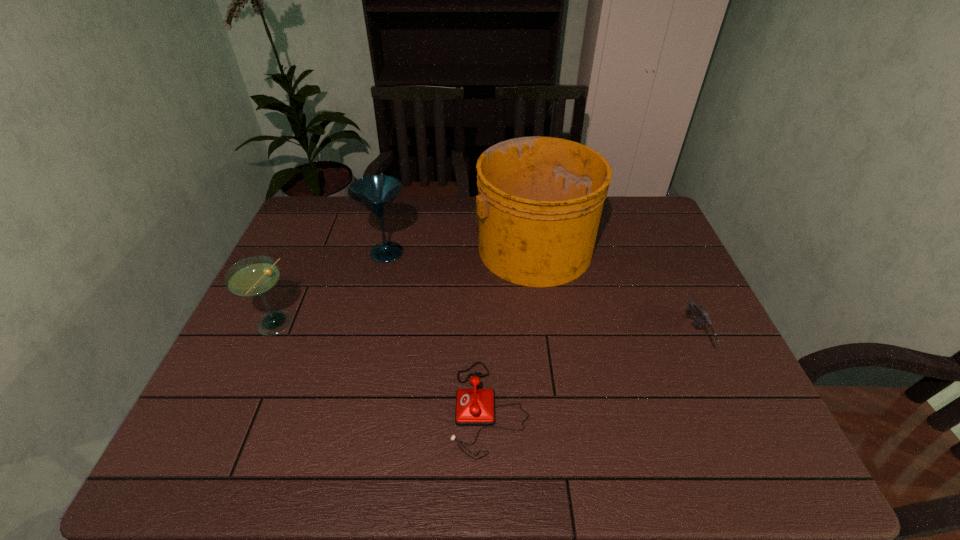
I want to click on free point between the left martini and the tallest object, so click(403, 286).

Where is `free area in between the nearer martini and the tallest object`? The image size is (960, 540). free area in between the nearer martini and the tallest object is located at coordinates (403, 286).

Where is `empty location between the gun and the shortest object`? empty location between the gun and the shortest object is located at coordinates (592, 372).

The image size is (960, 540). Find the location of `empty location between the bucket and the left martini`. empty location between the bucket and the left martini is located at coordinates (403, 286).

Find the location of a particular element. This screenshot has width=960, height=540. vacant area that lies between the left martini and the fourth shortest object is located at coordinates (330, 289).

Select which object appears as the second closest to the fourth shortest object. Please provide its 2D coordinates. Your answer should be formatted as a tuple, i.e. [(x, y)], where the tuple contains the x and y coordinates of a point satisfying the conditions above.

[(255, 276)]

Identify which object is located as the second nearest to the shortest object. Please provide its 2D coordinates. Your answer should be formatted as a tuple, i.e. [(x, y)], where the tuple contains the x and y coordinates of a point satisfying the conditions above.

[(376, 193)]

Find the location of `vacant region that satisfies the following two spatial constraints: 1. on the front side of the bucket; 2. on the dial of the nearest object`. vacant region that satisfies the following two spatial constraints: 1. on the front side of the bucket; 2. on the dial of the nearest object is located at coordinates (555, 408).

Where is `vacant space that satisfies the following two spatial constraints: 1. at the barrel of the gun; 2. on the dial of the nearest object`? The image size is (960, 540). vacant space that satisfies the following two spatial constraints: 1. at the barrel of the gun; 2. on the dial of the nearest object is located at coordinates (729, 408).

Image resolution: width=960 pixels, height=540 pixels. I want to click on vacant region that satisfies the following two spatial constraints: 1. at the barrel of the rightmost object; 2. on the dial of the nearest object, so click(x=729, y=408).